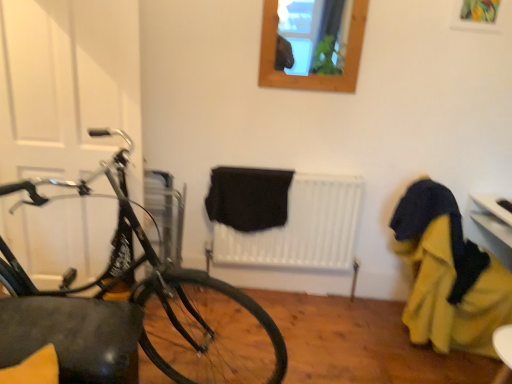
Question: Is white matte door at left bigger or smaller than wooden frame at upper center?

Choices:
 (A) small
 (B) big

Answer: (B)

Question: Based on their positions, is white matte door at left located to the left or right of wooden frame at upper center?

Choices:
 (A) left
 (B) right

Answer: (A)

Question: Which object is positioned closest to the white matte door at left?

Choices:
 (A) yellow fabric at right
 (B) wooden frame at upper center
 (C) shiny black bicycle at left
 (D) black matte radiator at center

Answer: (C)

Question: Considering the real-world distances, which object is closest to the wooden frame at upper center?

Choices:
 (A) white matte door at left
 (B) shiny black bicycle at left
 (C) black matte radiator at center
 (D) yellow fabric at right

Answer: (C)